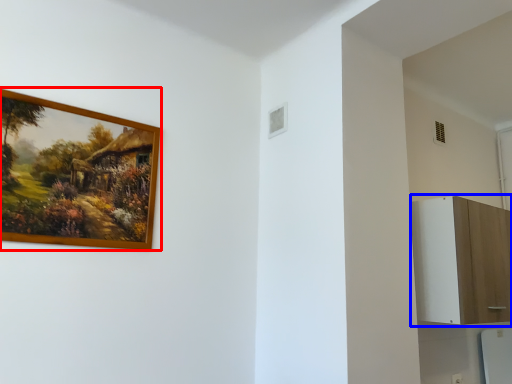
Question: Which of the following is the farthest to the observer, picture frame (highlighted by a red box) or dresser (highlighted by a blue box)?

Choices:
 (A) picture frame
 (B) dresser

Answer: (B)